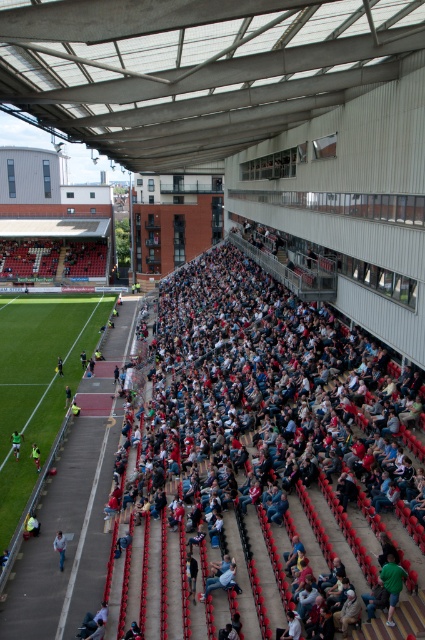
You are a photographer positioned at the edge of the stadium field. You want to take a photo of the yellow jersey at lower left without the dark blue jersey at lower left blocking it. Is this possible based on their current positions?

The dark blue jersey at lower left is in front of the yellow jersey at lower left, so it would block the view. To capture the yellow jersey at lower left without obstruction, you would need to adjust your position or angle to go around the dark blue jersey at lower left.

You are a spectator sitting in the stands and want to take a photo of the green grass football field at left and the yellow fabric jacket at lower left. Which object should you focus your camera on first to ensure both are in the same frame?

You should focus on the green grass football field at left first because it is closer to the viewer than the yellow fabric jacket at lower left, so adjusting focus from near to far will help capture both in the same frame.